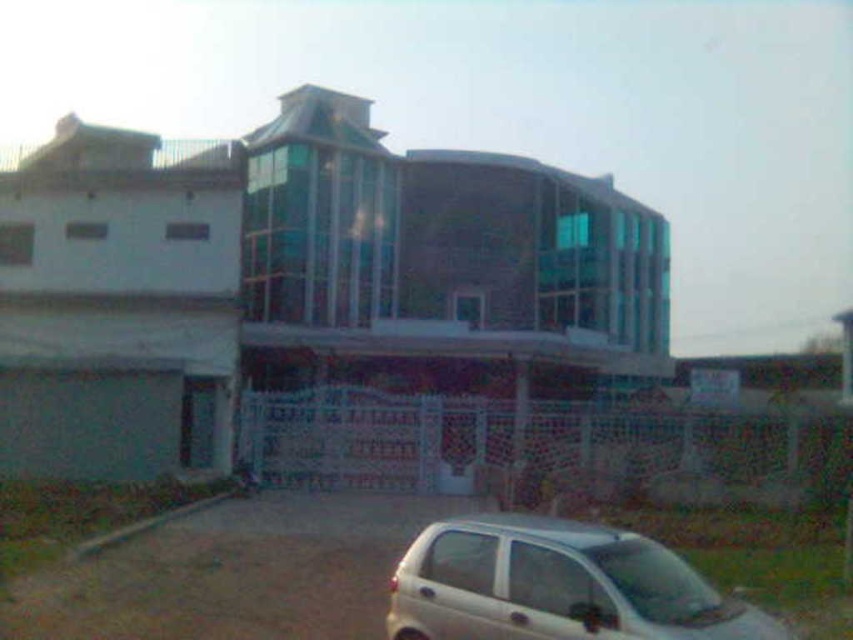
Question: Which object appears farthest from the camera in this image?

Choices:
 (A) brown gravel at lower center
 (B) white matte car at lower right

Answer: (A)

Question: Which of the following is the closest to the observer?

Choices:
 (A) brown gravel at lower center
 (B) white matte car at lower right

Answer: (B)

Question: Is brown gravel at lower center positioned behind white matte car at lower right?

Choices:
 (A) yes
 (B) no

Answer: (A)

Question: Does brown gravel at lower center have a greater width compared to white matte car at lower right?

Choices:
 (A) yes
 (B) no

Answer: (A)

Question: Considering the relative positions of brown gravel at lower center and white matte car at lower right in the image provided, where is brown gravel at lower center located with respect to white matte car at lower right?

Choices:
 (A) below
 (B) above

Answer: (A)